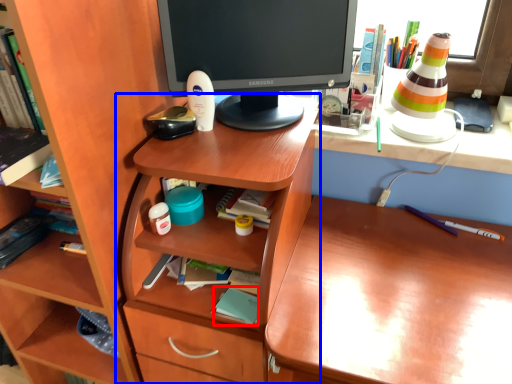
Question: Among these objects, which one is farthest to the camera, book (highlighted by a red box) or table (highlighted by a blue box)?

Choices:
 (A) book
 (B) table

Answer: (A)